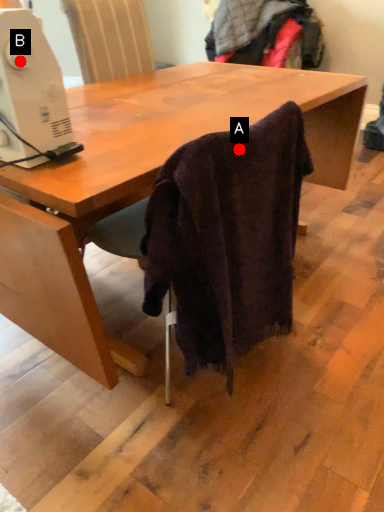
Question: Two points are circled on the image, labeled by A and B beside each circle. Which point is farther from the camera taking this photo?

Choices:
 (A) A is further
 (B) B is further

Answer: (A)